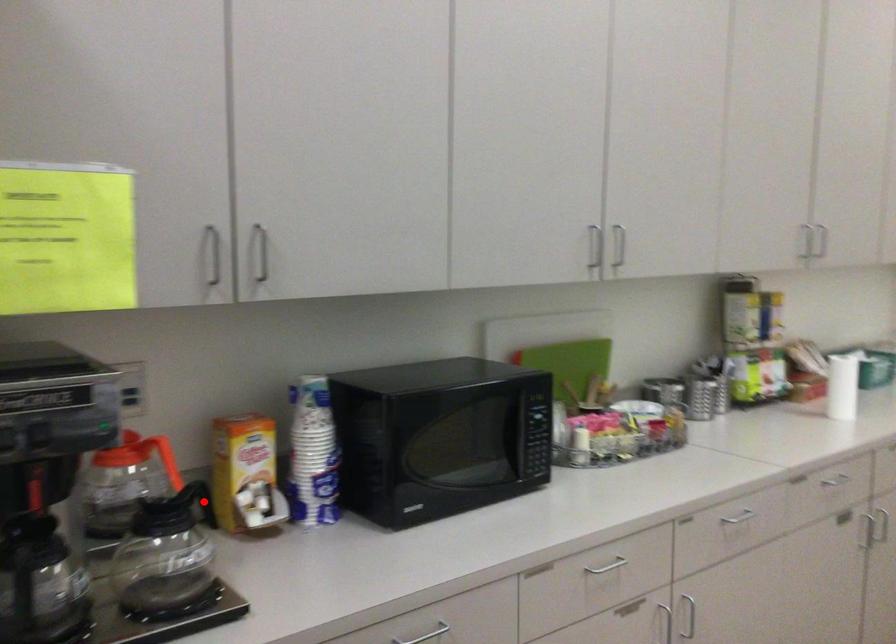
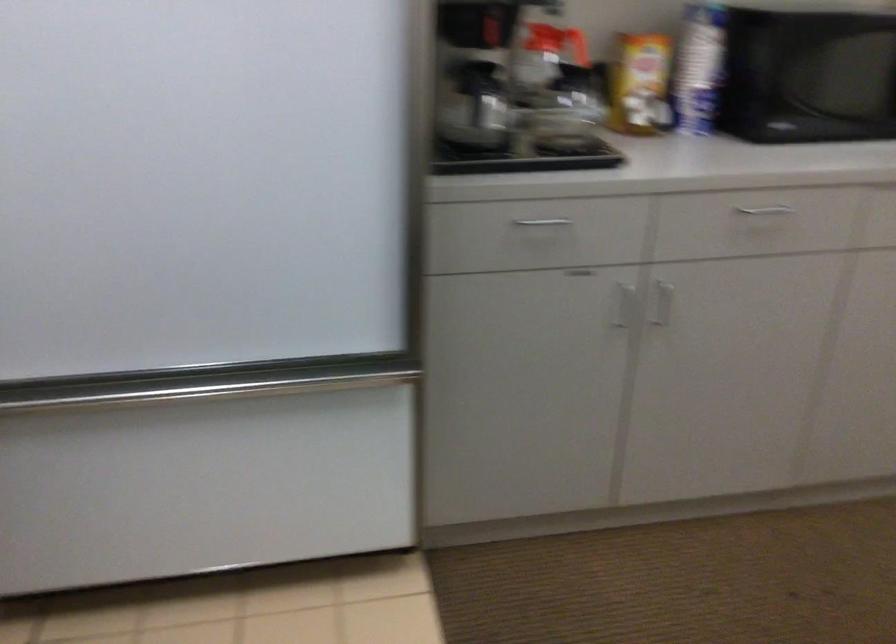
Where in the second image is the point corresponding to the highlighted location from the first image?

(604, 106)